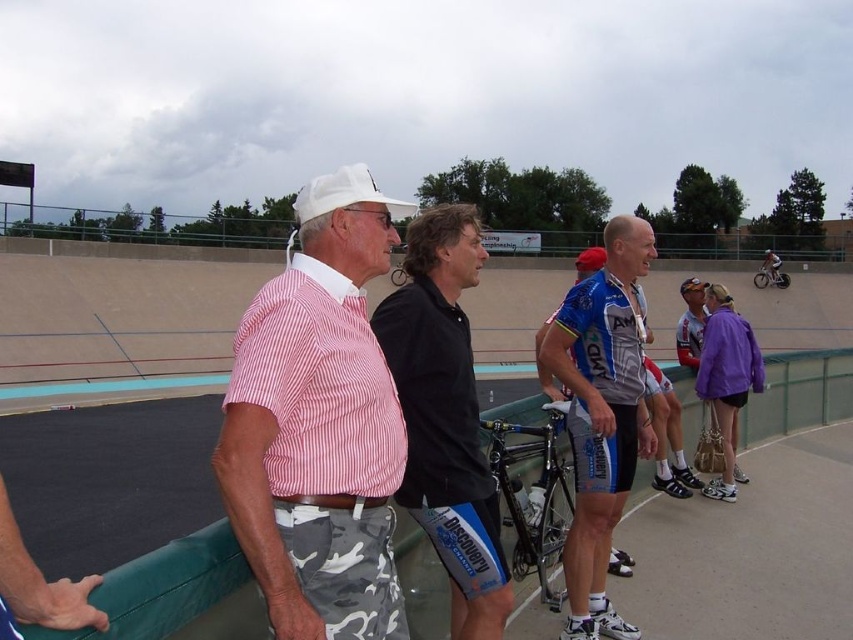
Which is above, pink striped shirt at center or blue jersey at center?

pink striped shirt at center is above.

At what (x,y) coordinates should I click in order to perform the action: click on pink striped shirt at center. Please return your answer as a coordinate pair (x, y). The height and width of the screenshot is (640, 853). Looking at the image, I should click on (318, 424).

Where is `pink striped shirt at center`? The image size is (853, 640). pink striped shirt at center is located at coordinates (318, 424).

Which is below, pink striped shirt at center or black jersey at center?

black jersey at center is lower down.

Is pink striped shirt at center wider than black jersey at center?

Yes.

This screenshot has height=640, width=853. What do you see at coordinates (318, 424) in the screenshot?
I see `pink striped shirt at center` at bounding box center [318, 424].

Find the location of `pink striped shirt at center`. pink striped shirt at center is located at coordinates tap(318, 424).

Can you confirm if black jersey at center is taller than blue jersey at center?

No.

Can you confirm if black jersey at center is positioned to the right of blue jersey at center?

In fact, black jersey at center is to the left of blue jersey at center.

Between point (405, 419) and point (561, 310), which one is positioned behind?

Point (561, 310)

Where is `black jersey at center`? The image size is (853, 640). black jersey at center is located at coordinates (445, 416).